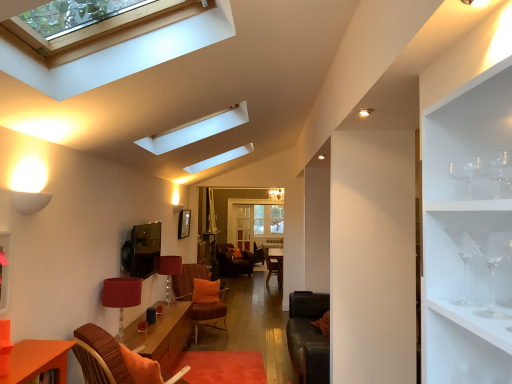
Measure the distance between pink matte shelf at left and camera.

The depth of pink matte shelf at left is 2.22 meters.

This screenshot has height=384, width=512. What are the coordinates of `orange fabric swivel chair at center, placed as the 1th swivel chair when sorted from back to front` in the screenshot? It's located at (201, 296).

Measure the distance between point (x=463, y=281) and camera.

They are 1.12 meters apart.

Find the location of a particular element. pink matte shelf at left is located at coordinates (4, 269).

Looking at this image, in terms of size, does pink matte shelf at left appear bigger or smaller than clear glass wine glass at right, which is counted as the third wine glass, starting from the front?

In the image, pink matte shelf at left appears to be larger than clear glass wine glass at right, which is counted as the third wine glass, starting from the front.

Considering the relative sizes of pink matte shelf at left and clear glass wine glass at right, which is counted as the third wine glass, starting from the front, in the image provided, is pink matte shelf at left thinner than clear glass wine glass at right, which is counted as the third wine glass, starting from the front,?

Yes.

Does pink matte shelf at left contain clear glass wine glass at right, the 1th wine glass in the back-to-front sequence?

No, clear glass wine glass at right, the 1th wine glass in the back-to-front sequence, is not a part of pink matte shelf at left.

Find the location of a particular element. the 1st wine glass in front of the pink matte shelf at left, starting your count from the anchor is located at coordinates point(463,264).

Is clear glass wine glass at right, which is counted as the third wine glass, starting from the front, at the back of orange fabric pillow at center?

No, orange fabric pillow at center's orientation is not away from clear glass wine glass at right, which is counted as the third wine glass, starting from the front.

How much distance is there between orange fabric pillow at center and clear glass wine glass at right, which is counted as the third wine glass, starting from the front?

orange fabric pillow at center is 16.38 feet from clear glass wine glass at right, which is counted as the third wine glass, starting from the front.

Consider the image. Is the depth of orange fabric pillow at center greater than that of clear glass wine glass at right, which is counted as the third wine glass, starting from the front?

That is True.

From the picture: From a real-world perspective, is orange fabric pillow at center above or below clear glass wine glass at right, which is counted as the third wine glass, starting from the front?

orange fabric pillow at center is below clear glass wine glass at right, which is counted as the third wine glass, starting from the front.

Based on the photo, can you see clear glass wine glass at upper right, which is counted as the 3th wine glass, starting from the back, touching wooden armchair at center?

No.

Based on the photo, is clear glass wine glass at upper right, acting as the first wine glass starting from the front, in front of or behind wooden armchair at center in the image?

clear glass wine glass at upper right, acting as the first wine glass starting from the front, is positioned closer to the viewer than wooden armchair at center.

From a real-world perspective, is clear glass wine glass at upper right, which is counted as the 3th wine glass, starting from the back, on wooden armchair at center?

Indeed, from a real-world perspective, clear glass wine glass at upper right, which is counted as the 3th wine glass, starting from the back, stands above wooden armchair at center.

In the image, is clear glass wine glass at upper right, which is counted as the 3th wine glass, starting from the back, on the left side or the right side of wooden armchair at center?

clear glass wine glass at upper right, which is counted as the 3th wine glass, starting from the back, is to the right of wooden armchair at center.

From a real-world perspective, which is physically below, clear glass wine glass at upper right, which is the 2th wine glass from front to back, or clear glass wine glass at upper right, which is counted as the 3th wine glass, starting from the back?

clear glass wine glass at upper right, which is the 2th wine glass from front to back.

Between point (477, 247) and point (506, 168), which one is positioned behind?

Positioned behind is point (477, 247).

Is clear glass wine glass at upper right, which is the second wine glass in back-to-front order, inside or outside of clear glass wine glass at upper right, acting as the first wine glass starting from the front?

clear glass wine glass at upper right, which is the second wine glass in back-to-front order, lies outside clear glass wine glass at upper right, acting as the first wine glass starting from the front.

Is clear glass wine glass at upper right, which is the second wine glass in back-to-front order, closer to the viewer compared to clear glass wine glass at upper right, acting as the first wine glass starting from the front?

No, clear glass wine glass at upper right, which is the second wine glass in back-to-front order, is further to the viewer.

Which is in front, point (8, 29) or point (169, 295)?

The point (8, 29) is closer to the camera.

Considering the relative positions of clear glass skylight at upper center and matte red lampshade at center, the 2th lamp from the front, in the image provided, is clear glass skylight at upper center to the left of matte red lampshade at center, the 2th lamp from the front, from the viewer's perspective?

No, clear glass skylight at upper center is not to the left of matte red lampshade at center, the 2th lamp from the front.

Is matte red lampshade at center, the 2th lamp from the front, inside clear glass skylight at upper center?

Actually, matte red lampshade at center, the 2th lamp from the front, is outside clear glass skylight at upper center.

Which object is more forward, matte red lampshade at lower left, the 2th lamp from the back, or clear glass wine glass at right, the 1th wine glass in the back-to-front sequence?

clear glass wine glass at right, the 1th wine glass in the back-to-front sequence.

Is matte red lampshade at lower left, the 2th lamp from the back, not near clear glass wine glass at right, the 1th wine glass in the back-to-front sequence?

Indeed, matte red lampshade at lower left, the 2th lamp from the back, is not near clear glass wine glass at right, the 1th wine glass in the back-to-front sequence.

Can you confirm if matte red lampshade at lower left, the 2th lamp from the back, is positioned to the left of clear glass wine glass at right, the 1th wine glass in the back-to-front sequence?

Yes, matte red lampshade at lower left, the 2th lamp from the back, is to the left of clear glass wine glass at right, the 1th wine glass in the back-to-front sequence.

Which point is more distant from viewer, (124, 287) or (465, 262)?

The point (124, 287) is farther from the camera.

Is clear glass skylight at upper center at the back of velvet orange swivel chair at lower left, placed as the 1th swivel chair when sorted from front to back?

No.

From a real-world perspective, between velvet orange swivel chair at lower left, the second swivel chair viewed from the back, and clear glass skylight at upper center, who is vertically higher?

In real-world perspective, clear glass skylight at upper center is above.

From the image's perspective, which one is positioned lower, velvet orange swivel chair at lower left, placed as the 1th swivel chair when sorted from front to back, or clear glass skylight at upper center?

From the image's view, velvet orange swivel chair at lower left, placed as the 1th swivel chair when sorted from front to back, is below.

There is a pink matte shelf at left. Where is `the 1st wine glass above it (from the image's perspective)`? The image size is (512, 384). the 1st wine glass above it (from the image's perspective) is located at coordinates (463, 264).

Find the location of `pillow on the left side of clear glass wine glass at right, which is counted as the third wine glass, starting from the front`. pillow on the left side of clear glass wine glass at right, which is counted as the third wine glass, starting from the front is located at coordinates (205, 291).

Looking at the image, which one is located further to clear glass wine glass at upper right, which is counted as the 3th wine glass, starting from the back, matte red lampshade at lower left, positioned as the first lamp in front-to-back order, or smooth orange rug at lower center?

smooth orange rug at lower center is further to clear glass wine glass at upper right, which is counted as the 3th wine glass, starting from the back.

Looking at the image, which one is located further to smooth orange rug at lower center, pink matte shelf at left or orange fabric swivel chair at center, placed as the 2th swivel chair when sorted from front to back?

pink matte shelf at left is further to smooth orange rug at lower center.

From the image, which object appears to be farther from smooth orange rug at lower center, clear glass wine glass at right, the 1th wine glass in the back-to-front sequence, or matte red lampshade at lower left, the 2th lamp from the back?

Among the two, clear glass wine glass at right, the 1th wine glass in the back-to-front sequence, is located further to smooth orange rug at lower center.

Looking at the image, which one is located closer to matte red lampshade at center, which appears as the first lamp when viewed from the back, clear glass skylight at upper center or clear glass wine glass at right, which is counted as the third wine glass, starting from the front?

clear glass skylight at upper center lies closer to matte red lampshade at center, which appears as the first lamp when viewed from the back, than the other object.

Estimate the real-world distances between objects in this image. Which object is closer to clear glass skylight at upper center, matte red lampshade at center, which appears as the first lamp when viewed from the back, or wooden armchair at center?

matte red lampshade at center, which appears as the first lamp when viewed from the back.

Considering their positions, is matte red lampshade at center, which appears as the first lamp when viewed from the back, positioned further to clear glass wine glass at upper right, acting as the first wine glass starting from the front, than clear glass wine glass at upper right, which is the 2th wine glass from front to back?

The object further to clear glass wine glass at upper right, acting as the first wine glass starting from the front, is matte red lampshade at center, which appears as the first lamp when viewed from the back.

Considering their positions, is matte red lampshade at center, the 2th lamp from the front, positioned closer to clear glass wine glass at right, the 1th wine glass in the back-to-front sequence, than pink matte shelf at left?

pink matte shelf at left lies closer to clear glass wine glass at right, the 1th wine glass in the back-to-front sequence, than the other object.

Which object lies further to the anchor point wooden armchair at center, clear glass skylight at upper center or pink matte shelf at left?

clear glass skylight at upper center.

Identify the location of swivel chair positioned between clear glass wine glass at right, the 1th wine glass in the back-to-front sequence, and orange fabric swivel chair at center, placed as the 1th swivel chair when sorted from back to front, from near to far. Image resolution: width=512 pixels, height=384 pixels. (102, 357).

Identify the location of swivel chair positioned between velvet orange swivel chair at lower left, placed as the 1th swivel chair when sorted from front to back, and orange fabric pillow at center from near to far. (201, 296).

Image resolution: width=512 pixels, height=384 pixels. I want to click on plain between clear glass wine glass at upper right, which is the second wine glass in back-to-front order, and orange fabric pillow at center from front to back, so click(x=223, y=367).

At what (x,y) coordinates should I click in order to perform the action: click on shelf between clear glass wine glass at right, the 1th wine glass in the back-to-front sequence, and wooden armchair at center from front to back. Please return your answer as a coordinate pair (x, y). The width and height of the screenshot is (512, 384). Looking at the image, I should click on (4, 269).